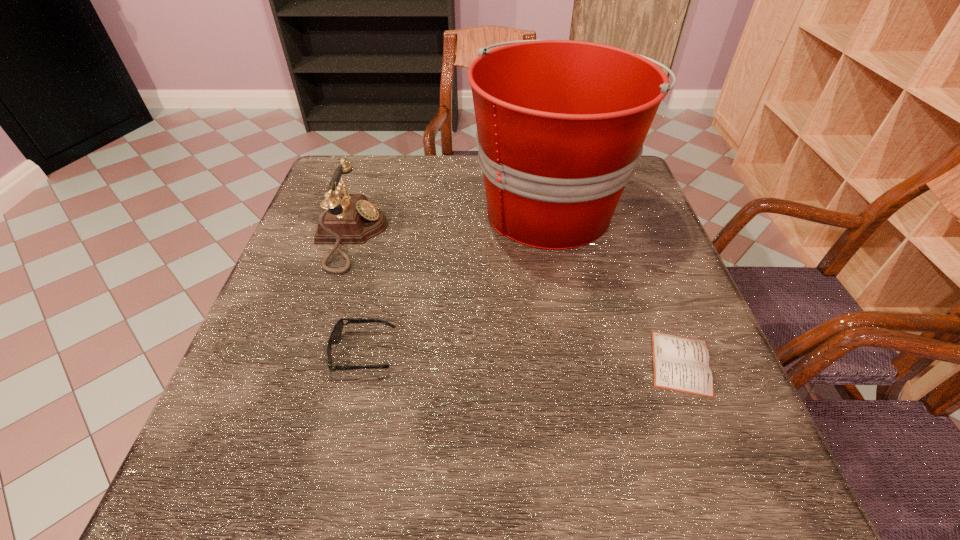
Where is `unoccupied area between the third tallest object and the third shortest object`? This screenshot has height=540, width=960. unoccupied area between the third tallest object and the third shortest object is located at coordinates (357, 294).

I want to click on free space between the shortest object and the second shortest object, so click(522, 357).

The width and height of the screenshot is (960, 540). In order to click on free space that is in between the shortest object and the third shortest object in this screenshot , I will do `click(516, 300)`.

Where is `vacant space in between the shortest object and the third shortest object`? The height and width of the screenshot is (540, 960). vacant space in between the shortest object and the third shortest object is located at coordinates (516, 300).

Identify the location of free spot between the shortest object and the tallest object. (616, 285).

Locate an element on the screen. The image size is (960, 540). free point between the tallest object and the sunglasses is located at coordinates (457, 280).

This screenshot has width=960, height=540. In order to click on free spot between the tallest object and the shortest object in this screenshot , I will do `click(616, 285)`.

I want to click on free space between the third shortest object and the shortest object, so click(x=516, y=300).

You are a GUI agent. You are given a task and a screenshot of the screen. Output one action in this format:
    pyautogui.click(x=<x>, y=<y>)
    Task: Click on the vacant region between the tallest object and the shortest object
    Image resolution: width=960 pixels, height=540 pixels.
    Given the screenshot: What is the action you would take?
    pyautogui.click(x=616, y=285)

This screenshot has height=540, width=960. Find the location of `free space between the tallest object and the shortest object`. free space between the tallest object and the shortest object is located at coordinates (616, 285).